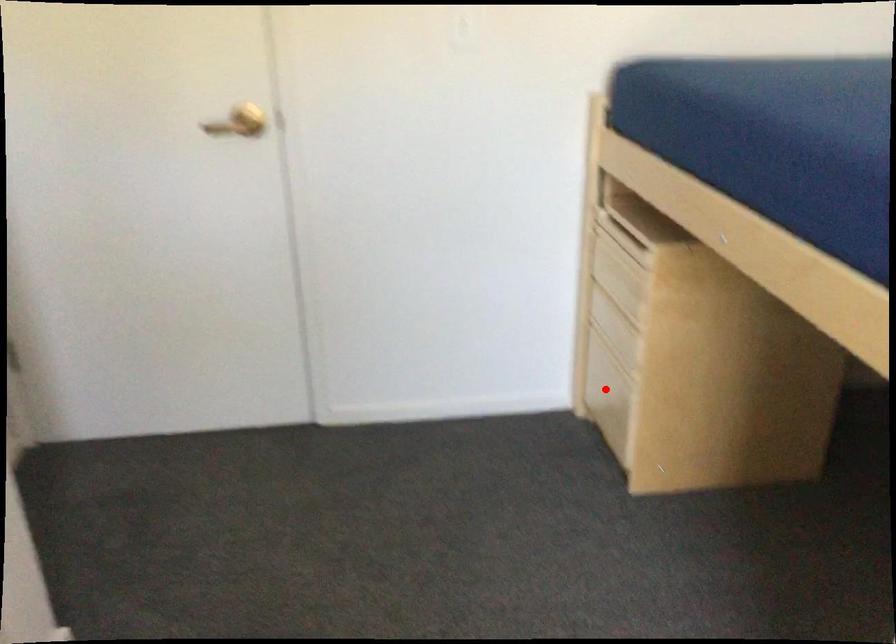
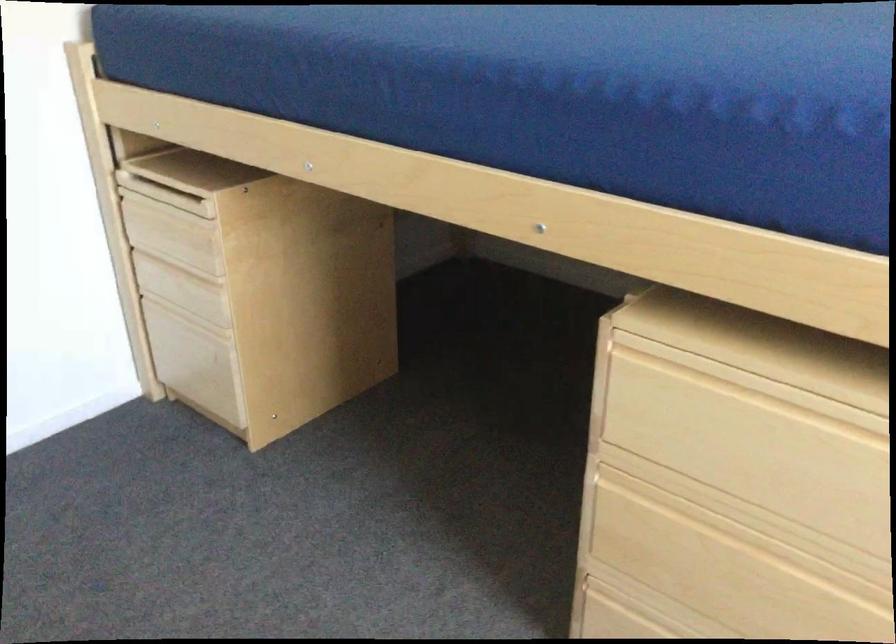
The point at the highlighted location is marked in the first image. Where is the corresponding point in the second image?

(195, 361)